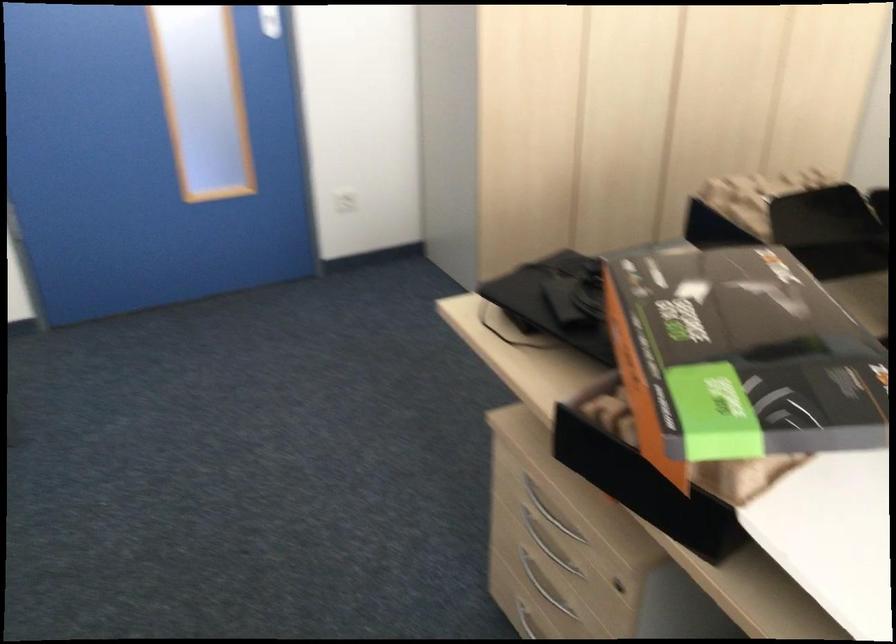
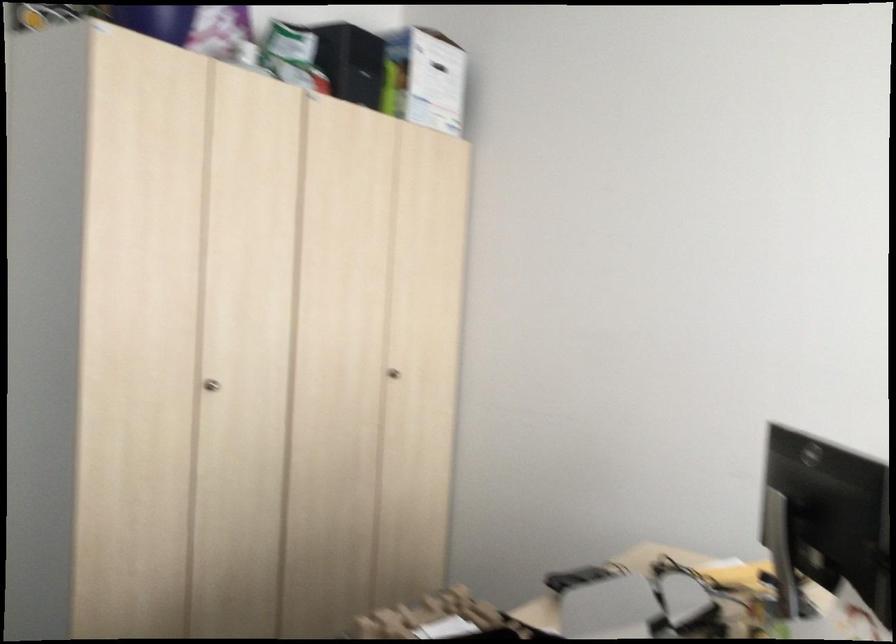
Based on the photo, how did the camera likely rotate?

The rotation direction of the camera is right-up.